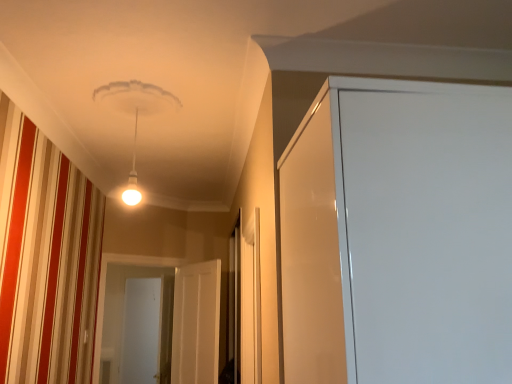
Question: In which direction should I rotate to look at white glossy screen door at center, arranged as the third screen door when viewed from the front?

Choices:
 (A) right
 (B) left

Answer: (B)

Question: Considering the relative sizes of white glossy door at center, arranged as the 3th screen door when viewed from the back, and white glossy door at center, placed as the 2th screen door when sorted from back to front, in the image provided, is white glossy door at center, arranged as the 3th screen door when viewed from the back, thinner than white glossy door at center, placed as the 2th screen door when sorted from back to front,?

Choices:
 (A) yes
 (B) no

Answer: (A)

Question: Could you tell me if white glossy door at center, which is the 1th screen door from right to left, is facing white glossy door at center, which is the 2th screen door in front-to-back order?

Choices:
 (A) yes
 (B) no

Answer: (A)

Question: Is white glossy door at center, which is the 1th screen door from right to left, in front of white glossy door at center, the 2th screen door in the right-to-left sequence?

Choices:
 (A) no
 (B) yes

Answer: (B)

Question: Does white glossy door at center, which ranks as the 1th screen door in front-to-back order, have a lesser height compared to white glossy door at center, the 2th screen door in the right-to-left sequence?

Choices:
 (A) yes
 (B) no

Answer: (A)

Question: From the image's perspective, would you say white glossy door at center, arranged as the 3th screen door when viewed from the back, is positioned over white glossy door at center, the 2th screen door in the right-to-left sequence?

Choices:
 (A) no
 (B) yes

Answer: (A)

Question: Considering the relative sizes of white glossy door at center, arranged as the 3th screen door when viewed from the back, and white glossy door at center, acting as the second screen door starting from the left, in the image provided, is white glossy door at center, arranged as the 3th screen door when viewed from the back, taller than white glossy door at center, acting as the second screen door starting from the left,?

Choices:
 (A) yes
 (B) no

Answer: (B)

Question: Considering the relative sizes of white glossy screen door at center, which appears as the 1th screen door when viewed from the back, and white glossy door at center, arranged as the 3th screen door when viewed from the back, in the image provided, is white glossy screen door at center, which appears as the 1th screen door when viewed from the back, shorter than white glossy door at center, arranged as the 3th screen door when viewed from the back,?

Choices:
 (A) no
 (B) yes

Answer: (A)

Question: Is white glossy screen door at center, arranged as the third screen door when viewed from the front, to the left of white glossy door at center, arranged as the 3th screen door when viewed from the left, from the viewer's perspective?

Choices:
 (A) yes
 (B) no

Answer: (A)

Question: Is white glossy screen door at center, arranged as the third screen door when viewed from the front, placed right next to white glossy door at center, arranged as the 3th screen door when viewed from the back?

Choices:
 (A) yes
 (B) no

Answer: (B)

Question: Is white glossy screen door at center, which appears as the third screen door when viewed from the right, positioned with its back to white glossy door at center, which is the 1th screen door from right to left?

Choices:
 (A) no
 (B) yes

Answer: (A)

Question: Does white glossy screen door at center, which appears as the 1th screen door when viewed from the back, have a smaller size compared to white glossy door at center, arranged as the 3th screen door when viewed from the left?

Choices:
 (A) yes
 (B) no

Answer: (B)

Question: Considering the relative sizes of white glossy screen door at center, which appears as the third screen door when viewed from the right, and white glossy door at center, arranged as the 3th screen door when viewed from the left, in the image provided, is white glossy screen door at center, which appears as the third screen door when viewed from the right, wider than white glossy door at center, arranged as the 3th screen door when viewed from the left,?

Choices:
 (A) no
 (B) yes

Answer: (B)

Question: Is white glossy door at center, which is the 2th screen door in front-to-back order, with white glossy door at center, arranged as the 3th screen door when viewed from the left?

Choices:
 (A) no
 (B) yes

Answer: (A)